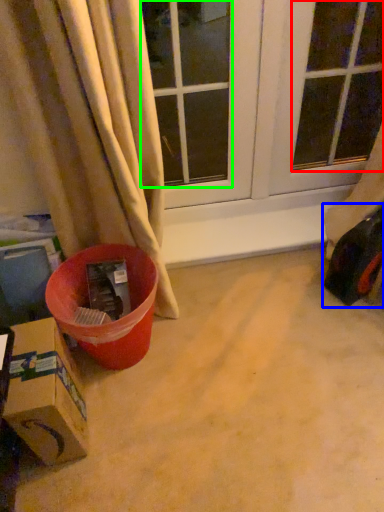
Question: Which is farther away from window screen (highlighted by a red box)? toy car (highlighted by a blue box) or window (highlighted by a green box)?

Choices:
 (A) toy car
 (B) window

Answer: (A)